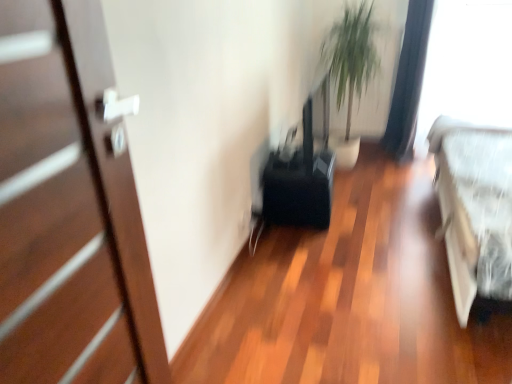
This screenshot has width=512, height=384. In order to click on free space in front of black fabric curtain at upper right in this screenshot , I will do `click(399, 161)`.